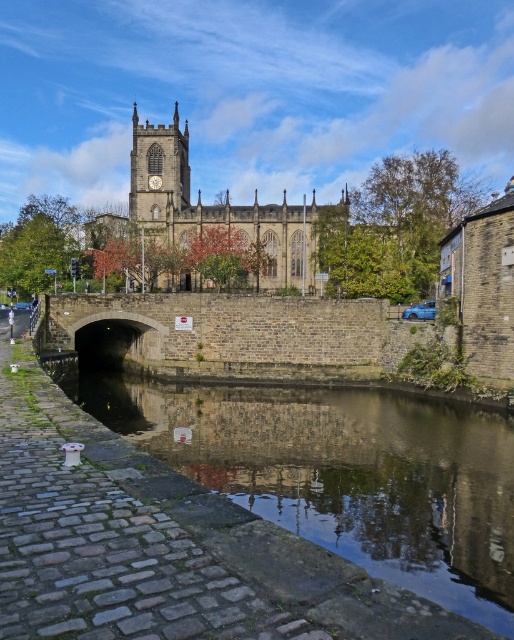
Between smooth stone river at lower left and stone clock tower at upper center, which one has less height?

Standing shorter between the two is smooth stone river at lower left.

Does smooth stone river at lower left lie in front of stone clock tower at upper center?

Yes.

Does point (247, 572) come behind point (145, 157)?

No.

Where is `smooth stone river at lower left`? This screenshot has width=514, height=640. smooth stone river at lower left is located at coordinates (265, 545).

Between smooth stone river at lower left and stone church at center, which one appears on the left side from the viewer's perspective?

stone church at center is more to the left.

Is smooth stone river at lower left bigger than stone church at center?

Actually, smooth stone river at lower left might be smaller than stone church at center.

Find the location of a particular element. The height and width of the screenshot is (640, 514). smooth stone river at lower left is located at coordinates (265, 545).

Can you confirm if stone church at center is taller than stone clock tower at upper center?

Yes.

Which is more to the left, stone church at center or stone clock tower at upper center?

stone clock tower at upper center is more to the left.

Is point (156, 154) less distant than point (133, 150)?

Yes, point (156, 154) is in front of point (133, 150).

Where is `stone church at center`? stone church at center is located at coordinates coord(200,202).